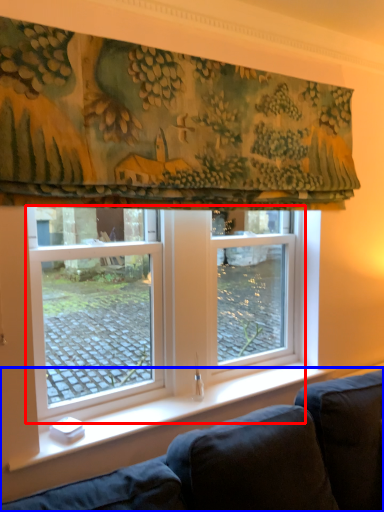
Question: Which object appears farthest to the camera in this image, window (highlighted by a red box) or studio couch (highlighted by a blue box)?

Choices:
 (A) window
 (B) studio couch

Answer: (A)